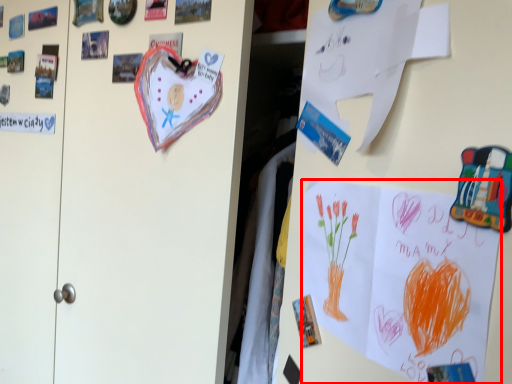
Question: From the image's perspective, what is the correct spatial positioning of poster (annotated by the red box) in reference to paper?

Choices:
 (A) below
 (B) above

Answer: (A)